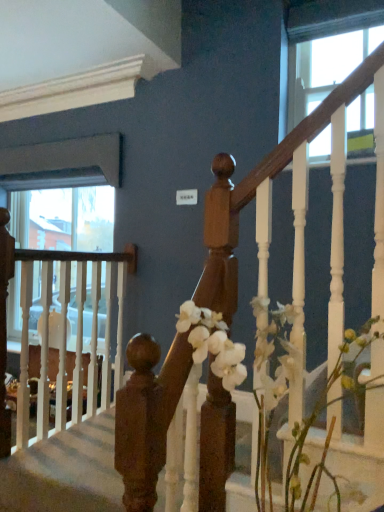
This screenshot has height=512, width=384. In order to click on blank space situated above wooden handrail at center (from a real-world perspective) in this screenshot , I will do `click(81, 445)`.